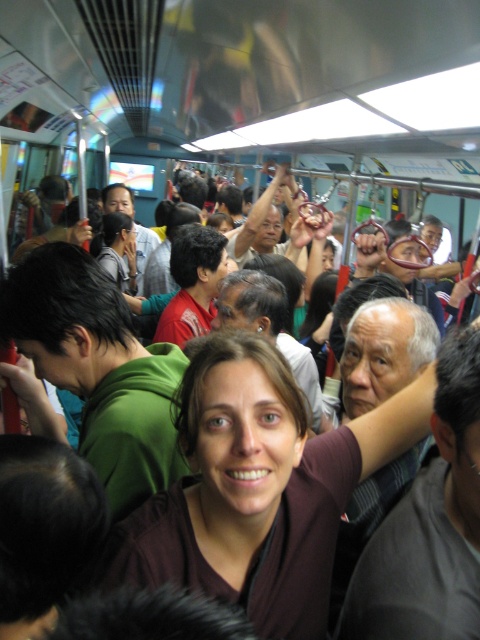
Question: Which of the following is the farthest from the observer?

Choices:
 (A) matte green shirt at center
 (B) brown matte shirt at center

Answer: (A)

Question: Which point is farther to the camera?

Choices:
 (A) brown matte shirt at center
 (B) matte green shirt at center

Answer: (B)

Question: Can you confirm if brown matte shirt at center is wider than matte green shirt at center?

Choices:
 (A) yes
 (B) no

Answer: (A)

Question: Is brown matte shirt at center wider than matte green shirt at center?

Choices:
 (A) no
 (B) yes

Answer: (B)

Question: Does brown matte shirt at center appear on the right side of matte green shirt at center?

Choices:
 (A) yes
 (B) no

Answer: (A)